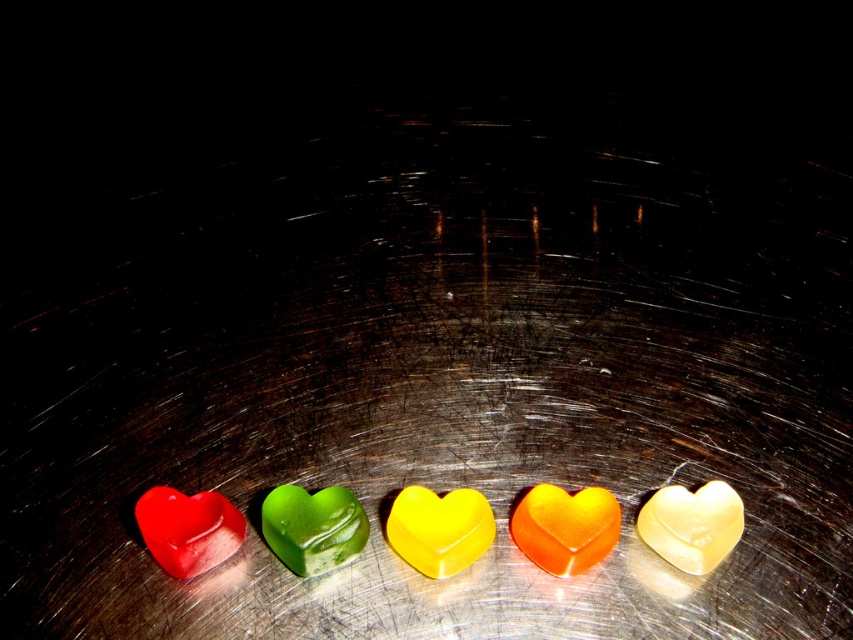
You are a photographer standing 1.5 meters away from the camera. You want to take a photo of the green translucent heart at center. Can you adjust your position so that you are exactly 1.17 meters away from the heart?

The green translucent heart at center and camera are 1.17 meters apart. Since you are standing 1.5 meters away from the camera, you can move closer by 0.33 meters to be exactly 1.17 meters away from the green translucent heart at center.

Looking at this image, you are organizing a display of colorful hearts on a metallic surface. You have a yellow translucent heart at center and a translucent yellow heart at center. Which one is directly below the other?

The yellow translucent heart at center is positioned under the translucent yellow heart at center, so the yellow translucent heart at center is directly below the translucent yellow heart at center.